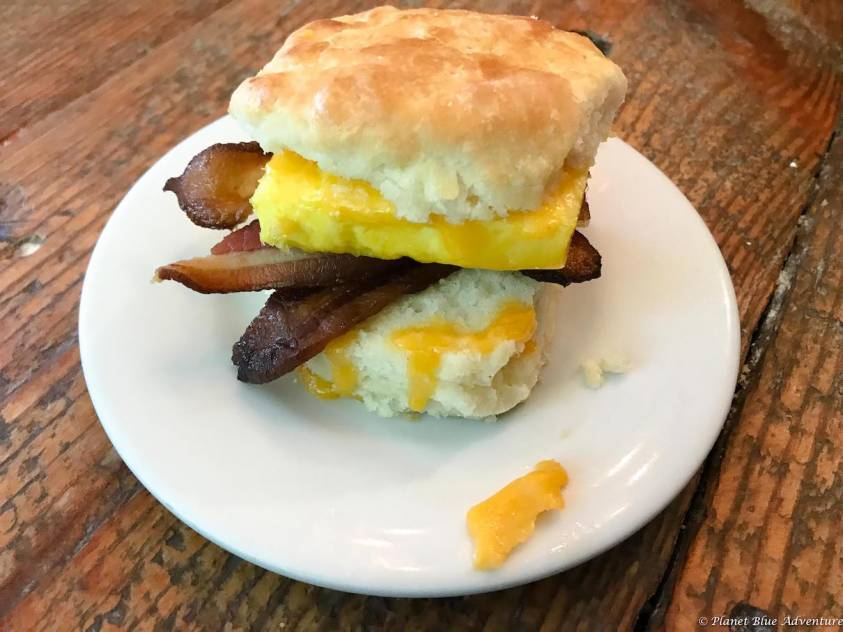
At what (x,y) coordinates should I click in order to perform the action: click on table scuffs. Please return your answer as a coordinate pair (x, y). This screenshot has height=632, width=843. Looking at the image, I should click on (776, 33).